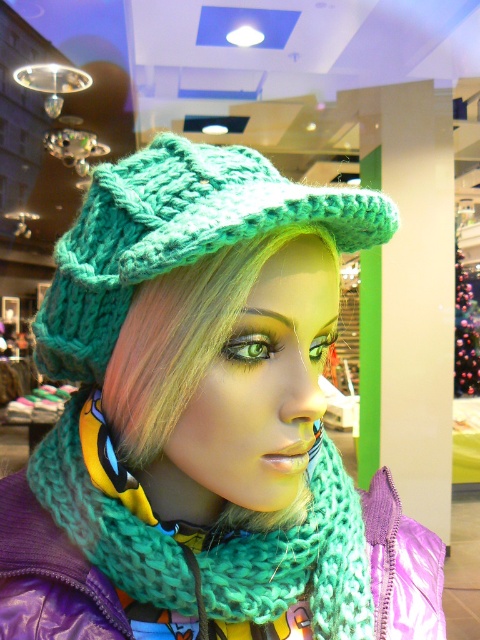
Question: Is knitted teal hat at center further to camera compared to teal knitted scarf at center?

Choices:
 (A) no
 (B) yes

Answer: (A)

Question: Which point appears farthest from the camera in this image?

Choices:
 (A) (283, 356)
 (B) (344, 588)

Answer: (B)

Question: Which is nearer to the teal knitted scarf at center?

Choices:
 (A) knitted teal hat at center
 (B) green knitted hat at center

Answer: (A)

Question: Where is teal knitted scarf at center located in relation to green knitted hat at center in the image?

Choices:
 (A) above
 (B) below

Answer: (B)

Question: Which point is farther to the camera?

Choices:
 (A) (391, 224)
 (B) (156, 576)
 (C) (226, 502)

Answer: (C)

Question: Where is knitted teal hat at center located in relation to teal knitted scarf at center in the image?

Choices:
 (A) above
 (B) below

Answer: (A)